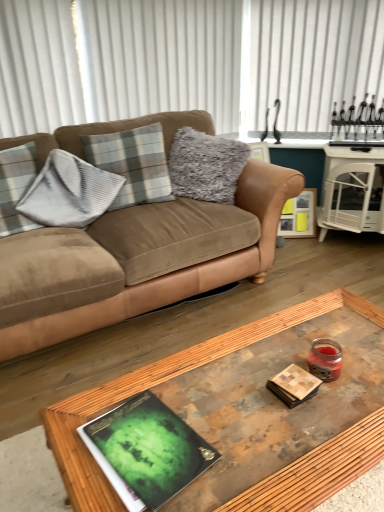
This screenshot has width=384, height=512. Identify the location of vacant space behind matte brown book at center. click(281, 348).